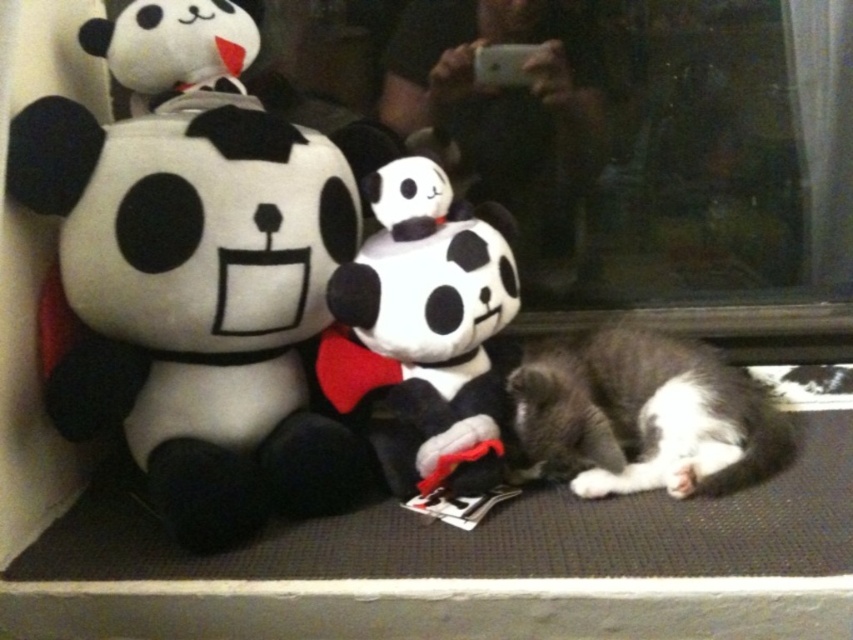
Question: Is soft plush toy at center to the left of gray-furred cat at lower right from the viewer's perspective?

Choices:
 (A) yes
 (B) no

Answer: (A)

Question: From the image, what is the correct spatial relationship of soft plush panda at center in relation to soft plush toy at center?

Choices:
 (A) right
 (B) left

Answer: (B)

Question: Among these points, which one is nearest to the camera?

Choices:
 (A) (322, 372)
 (B) (167, 42)

Answer: (B)

Question: Observing the image, what is the correct spatial positioning of soft plush panda at left in reference to soft plush panda at center?

Choices:
 (A) left
 (B) right

Answer: (A)

Question: Which point is farther to the camera?

Choices:
 (A) (286, 160)
 (B) (233, 12)
 (C) (473, 244)
 (D) (476, 122)

Answer: (D)

Question: Which of these objects is positioned closest to the soft plush panda at center?

Choices:
 (A) gray-furred cat at lower right
 (B) soft plush toy at center

Answer: (A)